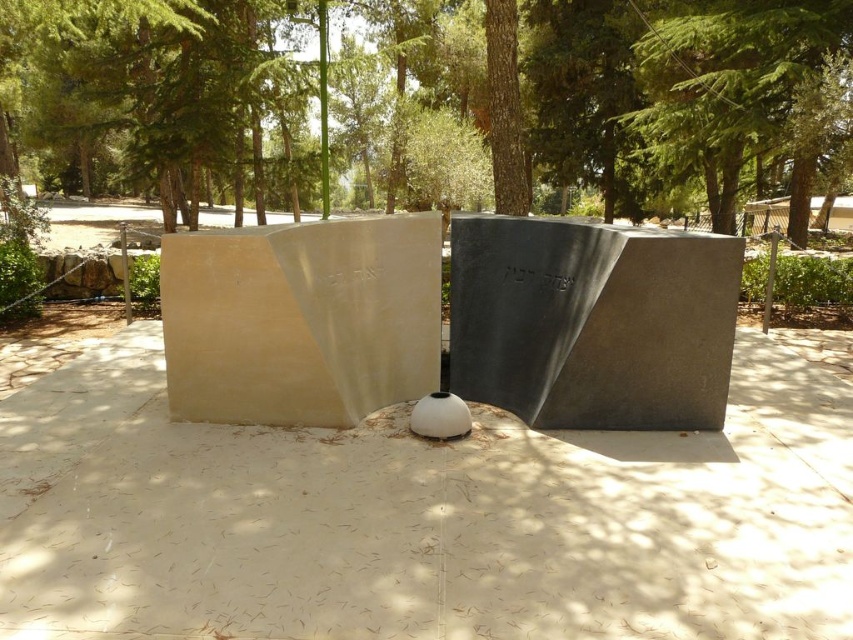
Question: Is green leafy tree at center to the right of black polished stone at center from the viewer's perspective?

Choices:
 (A) yes
 (B) no

Answer: (B)

Question: Which point appears farthest from the camera in this image?

Choices:
 (A) (78, 88)
 (B) (622, 368)
 (C) (61, 449)

Answer: (A)

Question: Which point is closer to the camera taking this photo?

Choices:
 (A) (573, 330)
 (B) (224, 163)

Answer: (A)

Question: Considering the real-world distances, which object is farthest from the black polished stone at center?

Choices:
 (A) beige concrete at center
 (B) green leafy tree at center

Answer: (B)

Question: Is green leafy tree at center to the right of black polished stone at center from the viewer's perspective?

Choices:
 (A) no
 (B) yes

Answer: (A)

Question: Does beige concrete at center have a larger size compared to black polished stone at center?

Choices:
 (A) yes
 (B) no

Answer: (A)